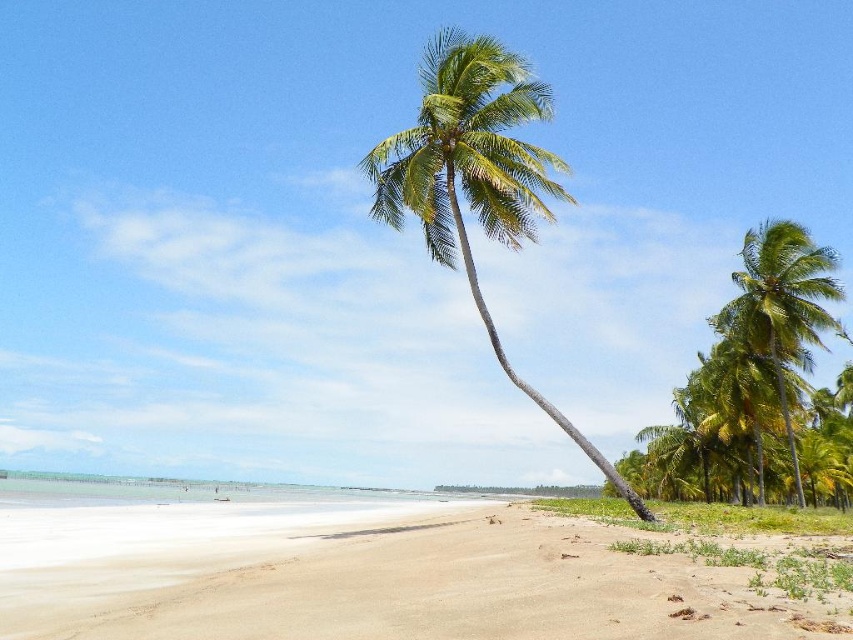
You are standing on the beach and want to take a photo of both the green leafy palm tree at center and the green leafy palm tree at right. Which palm tree will appear closer to the camera in your photo?

The green leafy palm tree at center will appear closer to the camera in your photo because it is positioned in front of the green leafy palm tree at right.

You are standing at the beach looking towards the ocean. You see two points marked on the sand. The first point is at coordinate point(427, 131) and the second is at point(735, 308). If you want to walk towards the second point, which direction should you move relative to the first point?

To reach point(735, 308) from point(427, 131), you should move towards the upper right direction since point(735, 308) is located above and to the right of point(427, 131).

You are standing on the sandy beach at lower center and want to walk towards the green leafy palm tree at right. Which direction should you head to reach it?

Since the sandy beach at lower center is positioned on the left side of the green leafy palm tree at right, you should head to the right to reach the palm tree.